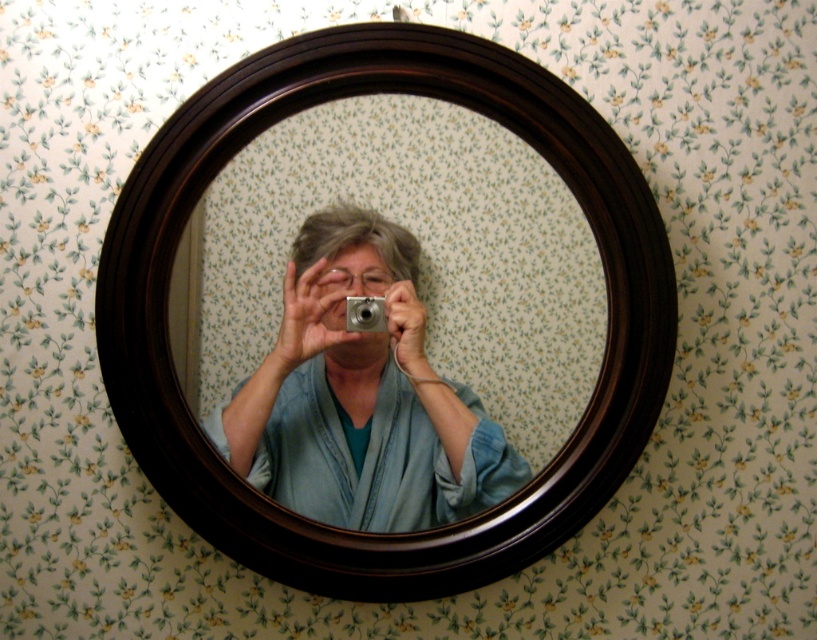
You are standing in a room with a mirror on the wall. You see a blue fabric at center and a silver metallic camera at center in the mirror. Which object is closer to the bottom edge of the mirror?

The blue fabric at center is closer to the bottom edge of the mirror because it is located below the silver metallic camera at center.

Looking at this image, you are standing in front of a mirror on a wall with floral wallpaper. You notice two points marked on the mirror at coordinates point (398, 566) and point (349, 305). Which point is closer to your face as you look into the mirror?

Point (349, 305) is closer to your face because it is closer to the camera than point (398, 566).